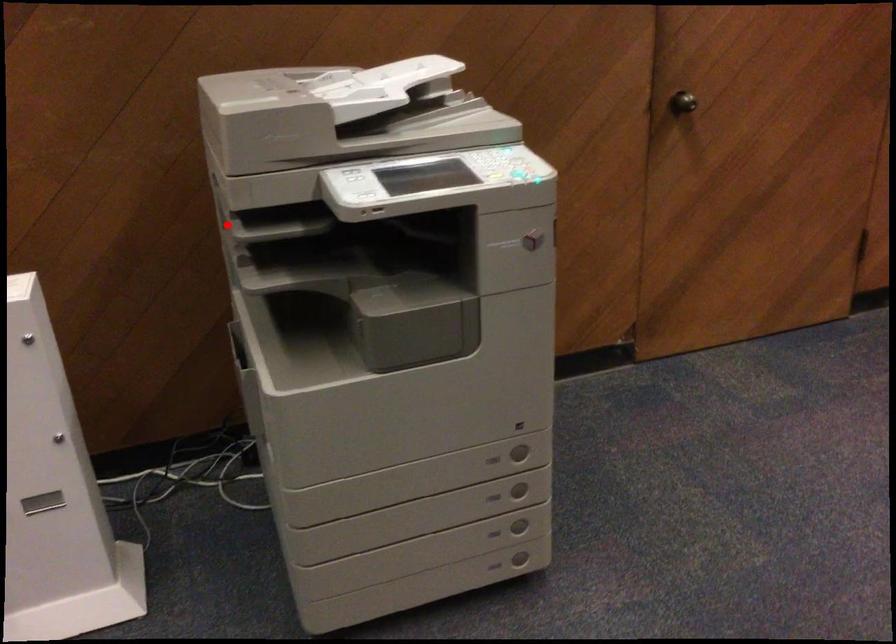
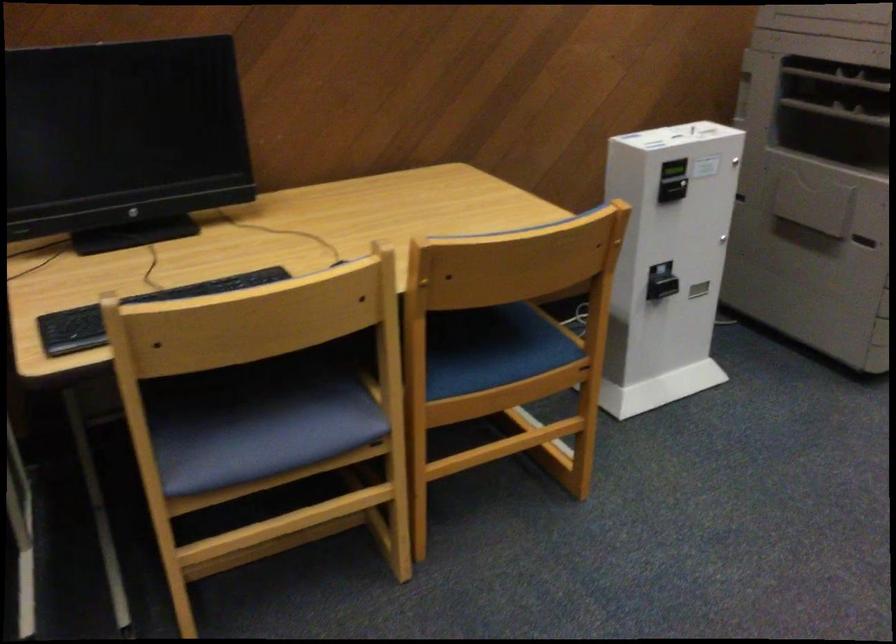
Question: I am providing you with two images of the same scene from different viewpoints. Given a red point in image1, look at the same physical point in image2. Is it:

Choices:
 (A) Closer to the viewpoint
 (B) Farther from the viewpoint

Answer: (B)